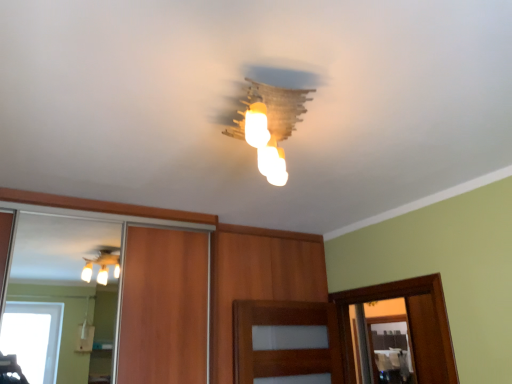
What do you see at coordinates (269, 125) in the screenshot?
I see `matte glass chandelier at center` at bounding box center [269, 125].

In order to face matte glass chandelier at center, should I rotate leftwards or rightwards?

Rotate your view right by about 1.253°.

This screenshot has width=512, height=384. I want to click on matte glass chandelier at center, so click(x=269, y=125).

At what (x,y) coordinates should I click in order to perform the action: click on matte glass chandelier at center. Please return your answer as a coordinate pair (x, y). Looking at the image, I should click on (269, 125).